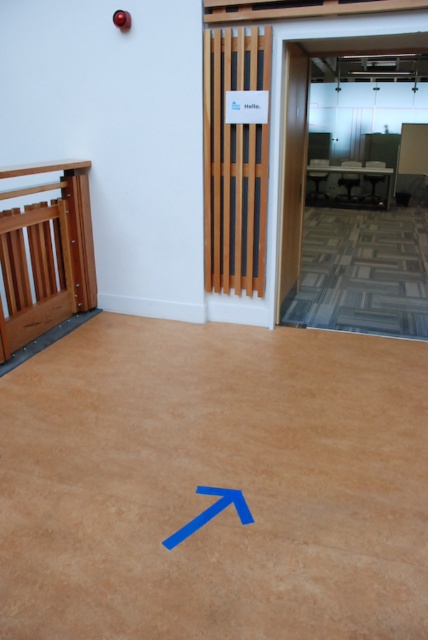
From the picture: Can you confirm if transparent glass elevator at upper center is wider than blue matte arrow at upper center?

Correct, the width of transparent glass elevator at upper center exceeds that of blue matte arrow at upper center.

Can you confirm if transparent glass elevator at upper center is bigger than blue matte arrow at upper center?

Indeed, transparent glass elevator at upper center has a larger size compared to blue matte arrow at upper center.

Describe the element at coordinates (363, 220) in the screenshot. The width and height of the screenshot is (428, 640). I see `transparent glass elevator at upper center` at that location.

Identify the location of transparent glass elevator at upper center. (363, 220).

Can you confirm if transparent glass elevator at upper center is shorter than wooden elevator at center?

No.

How far apart are transparent glass elevator at upper center and wooden elevator at center?

transparent glass elevator at upper center is 2.71 meters away from wooden elevator at center.

Is point (332, 268) farther from viewer compared to point (234, 218)?

Yes, it is behind point (234, 218).

Find the location of a particular element. transparent glass elevator at upper center is located at coordinates (363, 220).

Is transparent glass elevator at upper center thinner than wooden gate at left?

Incorrect, transparent glass elevator at upper center's width is not less than wooden gate at left's.

Between transparent glass elevator at upper center and wooden gate at left, which one is positioned lower?

wooden gate at left is below.

Between point (401, 317) and point (91, 272), which one is positioned in front?

Point (401, 317)

Where is `transparent glass elevator at upper center`? Image resolution: width=428 pixels, height=640 pixels. transparent glass elevator at upper center is located at coordinates (363, 220).